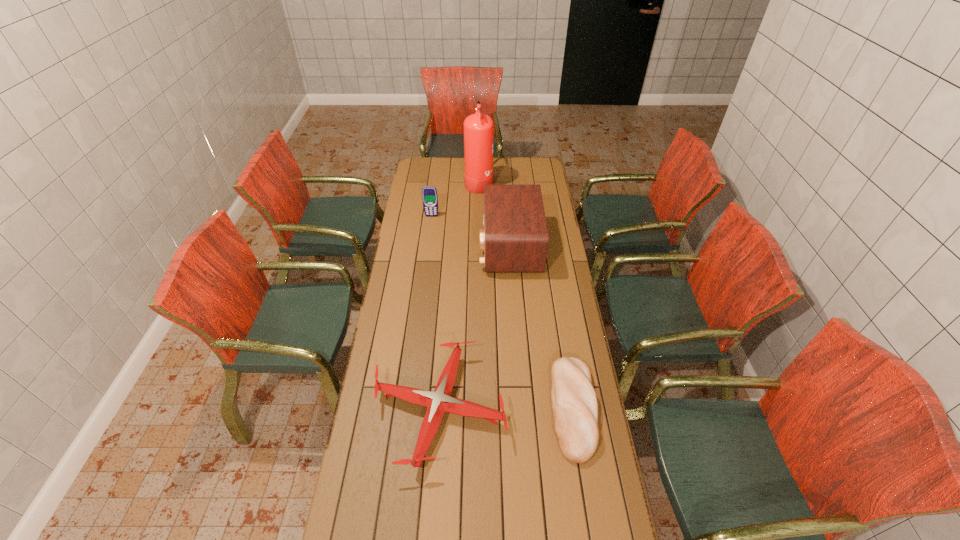
What are the coordinates of `the tallest object` in the screenshot? It's located at (478, 128).

The height and width of the screenshot is (540, 960). In order to click on the farthest object in this screenshot , I will do `click(478, 128)`.

Where is `radio receiver`? radio receiver is located at coordinates (515, 238).

This screenshot has height=540, width=960. I want to click on the fourth shortest object, so click(515, 238).

The height and width of the screenshot is (540, 960). In order to click on the second farthest object in this screenshot , I will do `click(429, 193)`.

Where is `cellular telephone`? cellular telephone is located at coordinates (429, 193).

The image size is (960, 540). In order to click on drone in this screenshot , I will do `click(437, 402)`.

At what (x,y) coordinates should I click in order to perform the action: click on bread. Please return your answer as a coordinate pair (x, y). Looking at the image, I should click on (574, 402).

I want to click on vacant space located 0.190m towards the nozzle of the tallest object, so click(x=526, y=181).

Locate an element on the screen. This screenshot has height=540, width=960. vacant space situated 0.200m on the front panel of the fourth shortest object is located at coordinates (438, 246).